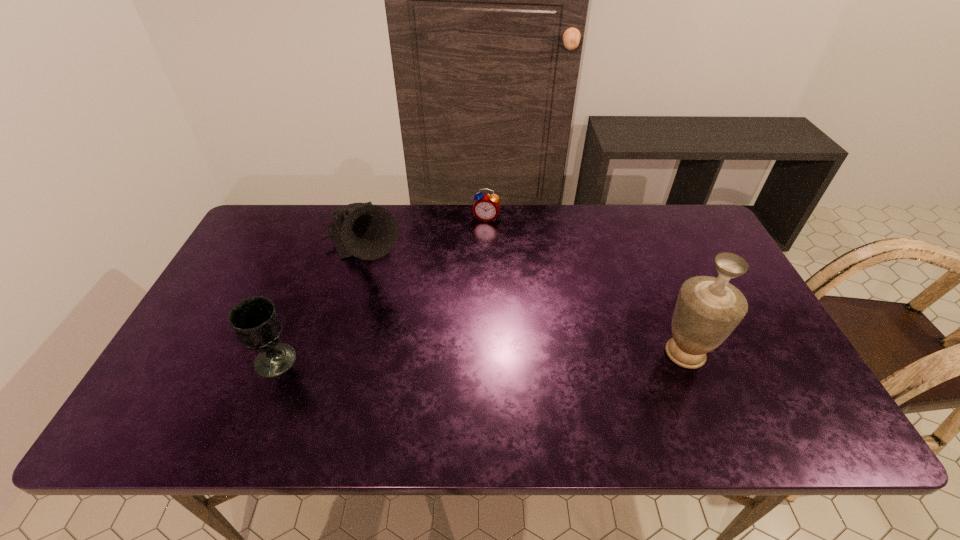
Locate an element on the screen. The height and width of the screenshot is (540, 960). chalice is located at coordinates (255, 321).

Find the location of a particular element. Image resolution: width=960 pixels, height=540 pixels. the rightmost object is located at coordinates (708, 309).

Locate an element on the screen. the second object from right to left is located at coordinates (486, 207).

The image size is (960, 540). In order to click on the shortest object in this screenshot , I will do `click(486, 207)`.

At what (x,y) coordinates should I click in order to perform the action: click on phonograph_record. Please return your answer as a coordinate pair (x, y). This screenshot has width=960, height=540. Looking at the image, I should click on (366, 231).

In order to click on free space located 0.340m on the back of the third tallest object in this screenshot , I will do click(319, 254).

Locate an element on the screen. vacant space located 0.300m on the back of the rightmost object is located at coordinates (645, 255).

What are the coordinates of `vacant point located on the front-facing side of the alarm clock` in the screenshot? It's located at (470, 268).

Where is `vacant space located 0.070m on the front-facing side of the alarm clock`? vacant space located 0.070m on the front-facing side of the alarm clock is located at coordinates (480, 237).

Locate an element on the screen. The width and height of the screenshot is (960, 540). vacant space located 0.140m on the front-facing side of the alarm clock is located at coordinates (475, 251).